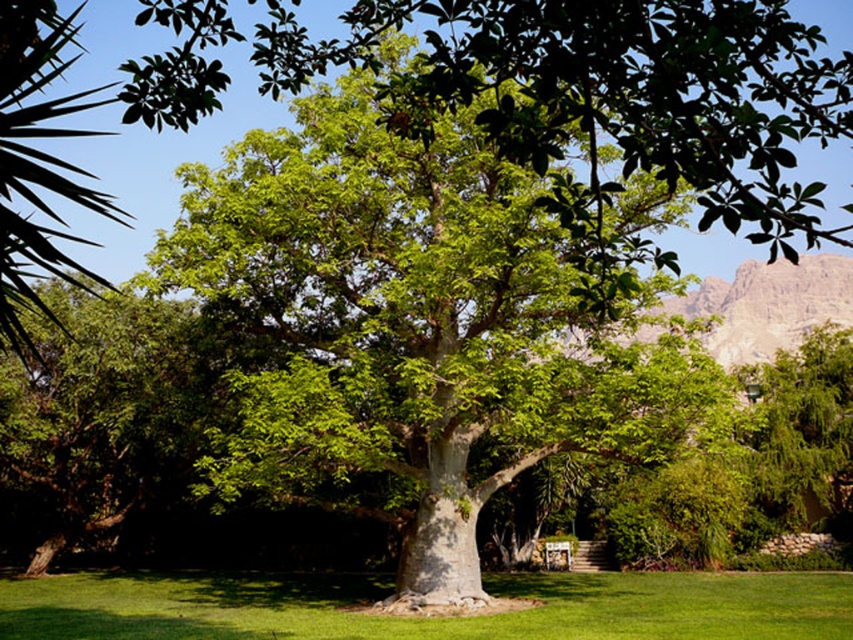
You are a gardener who needs to water both the green grass at center and the green leafy plant at left. If your watering can holds enough water for 10 meters of travel, can you water both without needing to refill?

The green grass at center and green leafy plant at left are 13.09 meters apart, so the total distance you need to travel is more than 10 meters. Therefore, you will need to refill your watering can before watering both.

You are planning to set up a picnic blanket in the park. The picnic blanket is 2 meters wide. Considering the green leafy oak tree at center and the green grass at center, which area would be more suitable for placing the blanket without overlapping the tree?

The green grass at center is wider than the green leafy oak tree at center, so placing the picnic blanket on the green grass at center would be more suitable as it has enough space to accommodate the 2 meter wide blanket without overlapping the tree.

You are standing at the base of the large baobab tree and see two points marked on the ground. One is at point (630, 352) and the other at point (438, 627). If you want to walk towards the point that is further away from you, which coordinate should you head towards?

Point (630, 352) is behind point (438, 627), so you should head towards point (630, 352) as it is further away from your current position at the base of the tree.